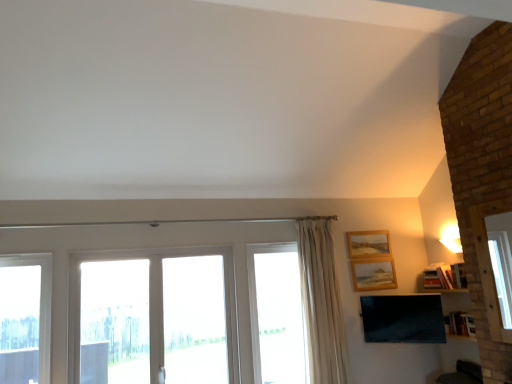
What do you see at coordinates (194, 320) in the screenshot?
I see `transparent glass screen door at center` at bounding box center [194, 320].

Describe the element at coordinates (373, 274) in the screenshot. I see `wooden picture frame at upper right, positioned as the second picture frame in top-to-bottom order` at that location.

What is the approximate width of transparent glass door at center, arranged as the second window when viewed from the left?

A: It is 3.14 inches.

The width and height of the screenshot is (512, 384). Describe the element at coordinates (153, 318) in the screenshot. I see `transparent glass door at center, arranged as the second window when viewed from the left` at that location.

Locate an element on the screen. Image resolution: width=512 pixels, height=384 pixels. beige fabric curtain at center is located at coordinates (322, 303).

I want to click on matte black tv at lower right, so click(x=403, y=319).

Which of these two, transparent glass screen door at center or matte black tv at lower right, is thinner?

Thinner between the two is matte black tv at lower right.

From the image's perspective, which one is positioned higher, transparent glass screen door at center or matte black tv at lower right?

transparent glass screen door at center is shown above in the image.

Is transparent glass screen door at center bigger or smaller than matte black tv at lower right?

transparent glass screen door at center is bigger than matte black tv at lower right.

Is matte black tv at lower right completely or partially inside transparent glass screen door at center?

No, matte black tv at lower right is located outside of transparent glass screen door at center.

Which of these two, transparent glass door at center, the 2th window when ordered from right to left, or wooden picture frame at upper right, marked as the first picture frame in a top-to-bottom arrangement, is smaller?

wooden picture frame at upper right, marked as the first picture frame in a top-to-bottom arrangement, is smaller.

Considering the points (127, 327) and (373, 236), which point is in front, point (127, 327) or point (373, 236)?

The point (127, 327) is in front.

Who is shorter, transparent glass door at center, arranged as the second window when viewed from the left, or wooden picture frame at upper right, marked as the first picture frame in a top-to-bottom arrangement?

wooden picture frame at upper right, marked as the first picture frame in a top-to-bottom arrangement.

Consider the image. From the image's perspective, is wooden picture frame at upper right, which appears as the second picture frame when ordered from the bottom, located above clear glass window at left, arranged as the 1th window when viewed from the left?

Correct, wooden picture frame at upper right, which appears as the second picture frame when ordered from the bottom, appears higher than clear glass window at left, arranged as the 1th window when viewed from the left, in the image.

Considering the relative positions of wooden picture frame at upper right, marked as the first picture frame in a top-to-bottom arrangement, and clear glass window at left, which appears as the 3th window when viewed from the right, in the image provided, is wooden picture frame at upper right, marked as the first picture frame in a top-to-bottom arrangement, to the left of clear glass window at left, which appears as the 3th window when viewed from the right, from the viewer's perspective?

No, wooden picture frame at upper right, marked as the first picture frame in a top-to-bottom arrangement, is not to the left of clear glass window at left, which appears as the 3th window when viewed from the right.

Measure the distance between wooden picture frame at upper right, which appears as the second picture frame when ordered from the bottom, and clear glass window at left, which appears as the 3th window when viewed from the right.

3.11 meters.

In the scene shown: Is clear glass window at left, which appears as the 3th window when viewed from the right, positioned behind matte black tv at lower right?

No, clear glass window at left, which appears as the 3th window when viewed from the right, is closer to the camera.

From the image's perspective, is clear glass window at left, which appears as the 3th window when viewed from the right, located above or below matte black tv at lower right?

clear glass window at left, which appears as the 3th window when viewed from the right, is situated higher than matte black tv at lower right in the image.

From a real-world perspective, which object rests below the other?

From a 3D spatial view, matte black tv at lower right is below.

Can matte black tv at lower right be found inside clear glass window at left, which appears as the 3th window when viewed from the right?

No, matte black tv at lower right is not surrounded by clear glass window at left, which appears as the 3th window when viewed from the right.

Considering the positions of point (382, 246) and point (183, 321), is point (382, 246) closer or farther from the camera than point (183, 321)?

Point (382, 246) appears to be farther away from the viewer than point (183, 321).

Considering the positions of objects wooden picture frame at upper right, marked as the first picture frame in a top-to-bottom arrangement, and transparent glass screen door at center in the image provided, who is behind, wooden picture frame at upper right, marked as the first picture frame in a top-to-bottom arrangement, or transparent glass screen door at center?

wooden picture frame at upper right, marked as the first picture frame in a top-to-bottom arrangement, is further from the camera.

Is wooden picture frame at upper right, marked as the first picture frame in a top-to-bottom arrangement, outside of transparent glass screen door at center?

wooden picture frame at upper right, marked as the first picture frame in a top-to-bottom arrangement, lies outside transparent glass screen door at center's area.

Is wooden picture frame at upper right, marked as the first picture frame in a top-to-bottom arrangement, smaller than transparent glass screen door at center?

Yes, wooden picture frame at upper right, marked as the first picture frame in a top-to-bottom arrangement, is smaller than transparent glass screen door at center.

Does wooden picture frame at upper right, positioned as the second picture frame in top-to-bottom order, come behind transparent glass door at center, the 2th window when ordered from right to left?

Yes, wooden picture frame at upper right, positioned as the second picture frame in top-to-bottom order, is further from the viewer.

Does wooden picture frame at upper right, positioned as the second picture frame in top-to-bottom order, turn towards transparent glass door at center, arranged as the second window when viewed from the left?

Answer: No, wooden picture frame at upper right, positioned as the second picture frame in top-to-bottom order, is not oriented towards transparent glass door at center, arranged as the second window when viewed from the left.

Is transparent glass door at center, arranged as the second window when viewed from the left, completely or partially inside wooden picture frame at upper right, positioned as the second picture frame in top-to-bottom order?

Actually, transparent glass door at center, arranged as the second window when viewed from the left, is outside wooden picture frame at upper right, positioned as the second picture frame in top-to-bottom order.

Which object is thinner, wooden picture frame at upper right, marked as the 1th picture frame in a bottom-to-top arrangement, or transparent glass door at center, the 2th window when ordered from right to left?

wooden picture frame at upper right, marked as the 1th picture frame in a bottom-to-top arrangement, is thinner.

You are a GUI agent. You are given a task and a screenshot of the screen. Output one action in this format:
    pyautogui.click(x=<x>, y=<y>)
    Task: Click on the curtain below the wooden picture frame at upper right, marked as the 1th picture frame in a bottom-to-top arrangement (from the image's perspective)
    
    Given the screenshot: What is the action you would take?
    pyautogui.click(x=322, y=303)

In the scene shown: Is beige fabric curtain at center to the left of wooden picture frame at upper right, marked as the 1th picture frame in a bottom-to-top arrangement, from the viewer's perspective?

Indeed, beige fabric curtain at center is positioned on the left side of wooden picture frame at upper right, marked as the 1th picture frame in a bottom-to-top arrangement.

Does point (312, 283) come behind point (380, 263)?

No, it is not.

Is beige fabric curtain at center completely or partially outside of wooden picture frame at upper right, positioned as the second picture frame in top-to-bottom order?

beige fabric curtain at center is positioned outside wooden picture frame at upper right, positioned as the second picture frame in top-to-bottom order.

The image size is (512, 384). I want to click on screen door that is on the left side of matte black tv at lower right, so click(x=194, y=320).

Locate an element on the screen. the 2nd picture frame above the transparent glass door at center, the 2th window when ordered from right to left (from a real-world perspective) is located at coordinates (368, 244).

Looking at this image, based on their spatial positions, is matte black tv at lower right or beige fabric curtain at center further from wooden picture frame at upper right, marked as the 1th picture frame in a bottom-to-top arrangement?

beige fabric curtain at center lies further to wooden picture frame at upper right, marked as the 1th picture frame in a bottom-to-top arrangement, than the other object.

Considering their positions, is beige fabric curtain at center positioned closer to transparent glass door at center, the 2th window when ordered from right to left, than wooden picture frame at upper right, marked as the 1th picture frame in a bottom-to-top arrangement?

The object closer to transparent glass door at center, the 2th window when ordered from right to left, is beige fabric curtain at center.

Based on their spatial positions, is transparent glass door at center, the 2th window when ordered from right to left, or clear glass window at center, arranged as the third window when viewed from the left, further from wooden picture frame at upper right, which appears as the second picture frame when ordered from the bottom?

transparent glass door at center, the 2th window when ordered from right to left, is further to wooden picture frame at upper right, which appears as the second picture frame when ordered from the bottom.

Based on the photo, from the image, which object appears to be nearer to wooden picture frame at upper right, marked as the first picture frame in a top-to-bottom arrangement, beige fabric curtain at center or transparent glass door at center, arranged as the second window when viewed from the left?

Among the two, beige fabric curtain at center is located nearer to wooden picture frame at upper right, marked as the first picture frame in a top-to-bottom arrangement.

When comparing their distances from matte black tv at lower right, does transparent glass door at center, the 2th window when ordered from right to left, or clear glass window at center, arranged as the 1th window when viewed from the right, seem closer?

The object closer to matte black tv at lower right is clear glass window at center, arranged as the 1th window when viewed from the right.

Looking at the image, which one is located closer to clear glass window at center, arranged as the third window when viewed from the left, beige fabric curtain at center or transparent glass screen door at center?

beige fabric curtain at center is closer to clear glass window at center, arranged as the third window when viewed from the left.

Which object lies nearer to the anchor point matte black tv at lower right, clear glass window at left, arranged as the 1th window when viewed from the left, or wooden picture frame at upper right, which appears as the second picture frame when ordered from the bottom?

wooden picture frame at upper right, which appears as the second picture frame when ordered from the bottom, is positioned closer to the anchor matte black tv at lower right.

When comparing their distances from wooden picture frame at upper right, marked as the first picture frame in a top-to-bottom arrangement, does clear glass window at left, which appears as the 3th window when viewed from the right, or matte black tv at lower right seem closer?

The object closer to wooden picture frame at upper right, marked as the first picture frame in a top-to-bottom arrangement, is matte black tv at lower right.

The height and width of the screenshot is (384, 512). I want to click on window between transparent glass door at center, arranged as the second window when viewed from the left, and wooden picture frame at upper right, marked as the 1th picture frame in a bottom-to-top arrangement, from left to right, so click(x=277, y=315).

Locate an element on the screen. screen door between transparent glass door at center, arranged as the second window when viewed from the left, and matte black tv at lower right is located at coordinates (194, 320).

The height and width of the screenshot is (384, 512). What are the coordinates of `window located between transparent glass door at center, the 2th window when ordered from right to left, and wooden picture frame at upper right, which appears as the second picture frame when ordered from the bottom, in the left-right direction` in the screenshot? It's located at (277, 315).

The image size is (512, 384). I want to click on window between transparent glass door at center, arranged as the second window when viewed from the left, and beige fabric curtain at center, so click(x=277, y=315).